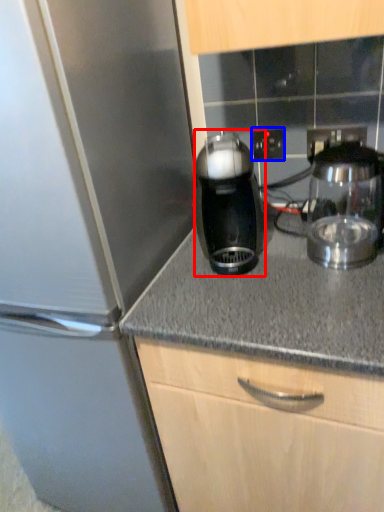
Question: Which of the following is the closest to the observer, kitchen appliance (highlighted by a red box) or electric outlet (highlighted by a blue box)?

Choices:
 (A) kitchen appliance
 (B) electric outlet

Answer: (A)